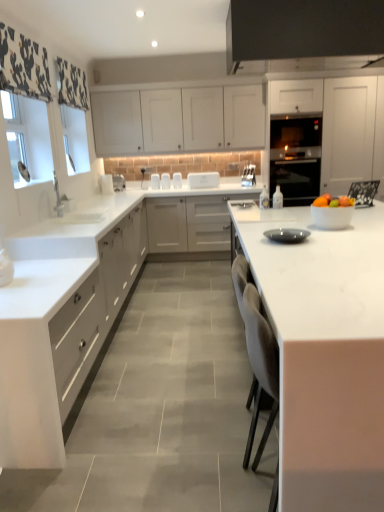
The image size is (384, 512). What are the coordinates of `vacant area to the right of matte gray plate at center, the 1th appliance positioned from the bottom` in the screenshot? It's located at (337, 237).